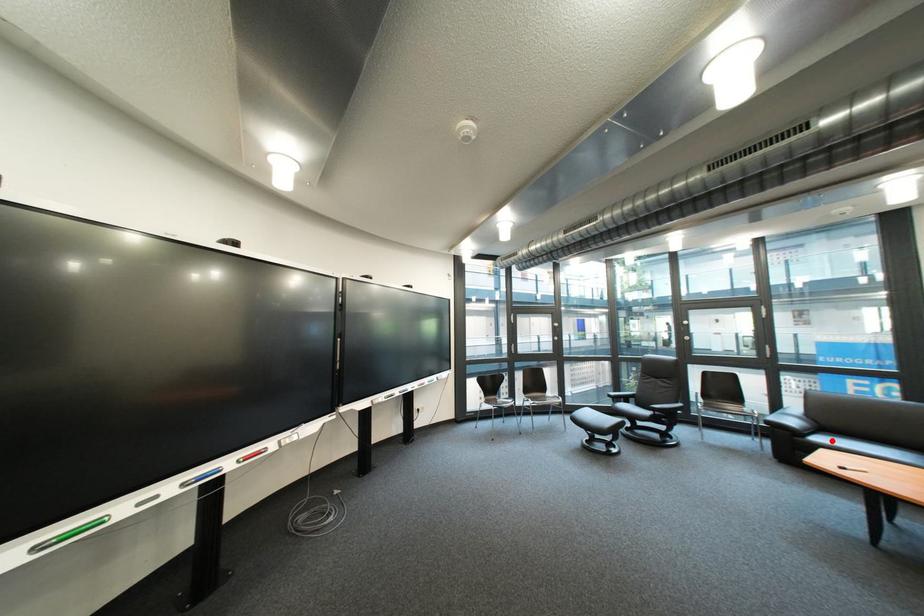
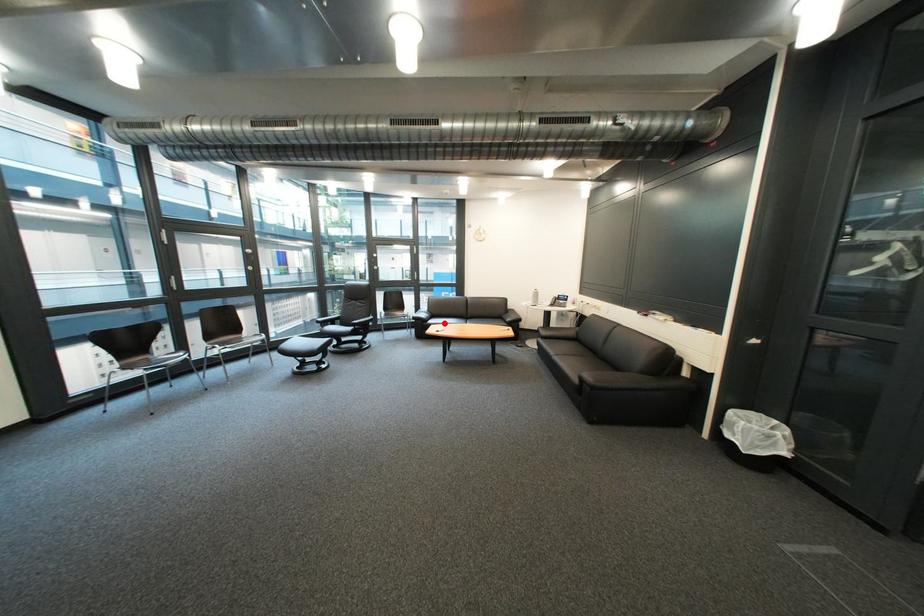
I am providing you with two images of the same scene from different viewpoints. A red point is marked on the first image and another point is marked on the second image. Do the highlighted points in image1 and image2 indicate the same real-world spot?

Yes